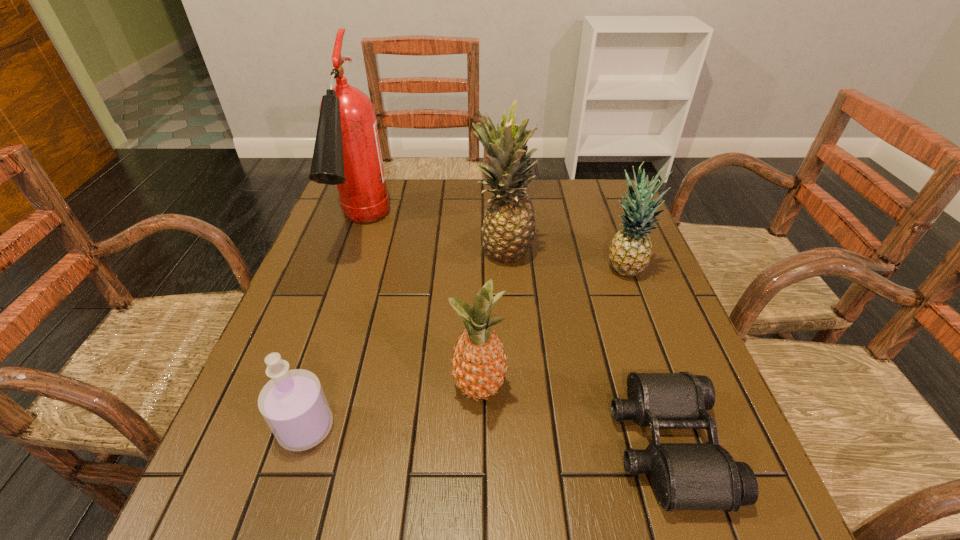
Identify the location of vacant space that is in between the nearest pineapple and the fire extinguisher. (420, 310).

This screenshot has height=540, width=960. Find the location of `free space between the nearest pineapple and the perfume`. free space between the nearest pineapple and the perfume is located at coordinates pos(393,409).

The height and width of the screenshot is (540, 960). What are the coordinates of `vacant area between the rightmost pineapple and the nearest pineapple` in the screenshot? It's located at (552, 331).

What are the coordinates of `vacant point located between the perfume and the fire extinguisher` in the screenshot? It's located at (334, 328).

Identify the location of empty space that is in between the rightmost pineapple and the nearest pineapple. (552, 331).

Find the location of a particular element. free space that is in between the fire extinguisher and the nearest pineapple is located at coordinates (420, 310).

You are a GUI agent. You are given a task and a screenshot of the screen. Output one action in this format:
    pyautogui.click(x=<x>, y=<y>)
    Task: Click on the object that is the fifth closest to the nearest pineapple
    
    Given the screenshot: What is the action you would take?
    pyautogui.click(x=347, y=153)

In order to click on object that is the second nearest to the nearest pineapple in this screenshot , I will do `click(293, 403)`.

Point out which pineapple is positioned as the nearest to the fifth shortest object. Please provide its 2D coordinates. Your answer should be formatted as a tuple, i.e. [(x, y)], where the tuple contains the x and y coordinates of a point satisfying the conditions above.

[(631, 248)]

Locate an element on the screen. This screenshot has width=960, height=540. the second closest pineapple to the nearest pineapple is located at coordinates (631, 248).